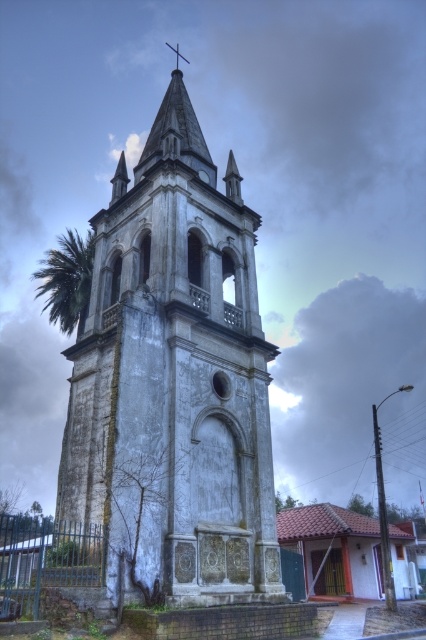
Is green leafy palm at left taller than metallic cross at upper center?

Yes.

Does green leafy palm at left appear under metallic cross at upper center?

Indeed, green leafy palm at left is positioned under metallic cross at upper center.

Is point (92, 240) farther from camera compared to point (166, 42)?

That is False.

Find the location of a particular element. The height and width of the screenshot is (640, 426). green leafy palm at left is located at coordinates (66, 280).

Which is more to the right, white stone tower at center or metallic cross at upper center?

From the viewer's perspective, white stone tower at center appears more on the right side.

Based on the photo, is white stone tower at center smaller than metallic cross at upper center?

Actually, white stone tower at center might be larger than metallic cross at upper center.

This screenshot has width=426, height=640. In order to click on white stone tower at center in this screenshot , I will do point(175,381).

Can you confirm if white stone tower at center is positioned to the left of green leafy palm at left?

No, white stone tower at center is not to the left of green leafy palm at left.

Looking at this image, which is below, white stone tower at center or green leafy palm at left?

white stone tower at center

Is point (233, 512) positioned after point (74, 301)?

That is False.

The height and width of the screenshot is (640, 426). Identify the location of white stone tower at center. (175, 381).